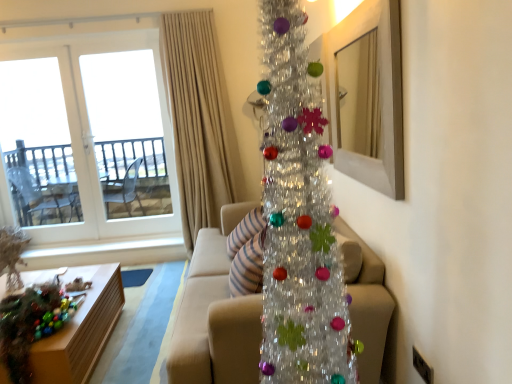
Question: Should I look upward or downward to see wooden mirror at upper right?

Choices:
 (A) down
 (B) up

Answer: (B)

Question: Can we say beige fabric curtain at upper center lies outside wooden mirror at upper right?

Choices:
 (A) yes
 (B) no

Answer: (A)

Question: Is beige fabric curtain at upper center closer to camera compared to wooden mirror at upper right?

Choices:
 (A) no
 (B) yes

Answer: (A)

Question: From a real-world perspective, is beige fabric curtain at upper center beneath wooden mirror at upper right?

Choices:
 (A) yes
 (B) no

Answer: (A)

Question: Is beige fabric curtain at upper center thinner than wooden mirror at upper right?

Choices:
 (A) yes
 (B) no

Answer: (B)

Question: Can you confirm if beige fabric curtain at upper center is positioned to the right of wooden mirror at upper right?

Choices:
 (A) no
 (B) yes

Answer: (A)

Question: Is beige fabric curtain at upper center facing away from wooden mirror at upper right?

Choices:
 (A) yes
 (B) no

Answer: (B)

Question: Would you consider beige fabric couch at center to be distant from shiny metallic christmas tree at center?

Choices:
 (A) no
 (B) yes

Answer: (A)

Question: Can you confirm if beige fabric couch at center is thinner than shiny metallic christmas tree at center?

Choices:
 (A) yes
 (B) no

Answer: (B)

Question: Is beige fabric couch at center oriented away from shiny metallic christmas tree at center?

Choices:
 (A) no
 (B) yes

Answer: (A)

Question: Is beige fabric couch at center positioned before shiny metallic christmas tree at center?

Choices:
 (A) yes
 (B) no

Answer: (B)

Question: Does beige fabric couch at center have a larger size compared to shiny metallic christmas tree at center?

Choices:
 (A) yes
 (B) no

Answer: (A)

Question: Considering the relative sizes of beige fabric couch at center and shiny metallic christmas tree at center in the image provided, is beige fabric couch at center shorter than shiny metallic christmas tree at center?

Choices:
 (A) no
 (B) yes

Answer: (B)

Question: Considering the relative sizes of beige fabric curtain at upper center and wooden table at lower left in the image provided, is beige fabric curtain at upper center wider than wooden table at lower left?

Choices:
 (A) no
 (B) yes

Answer: (A)